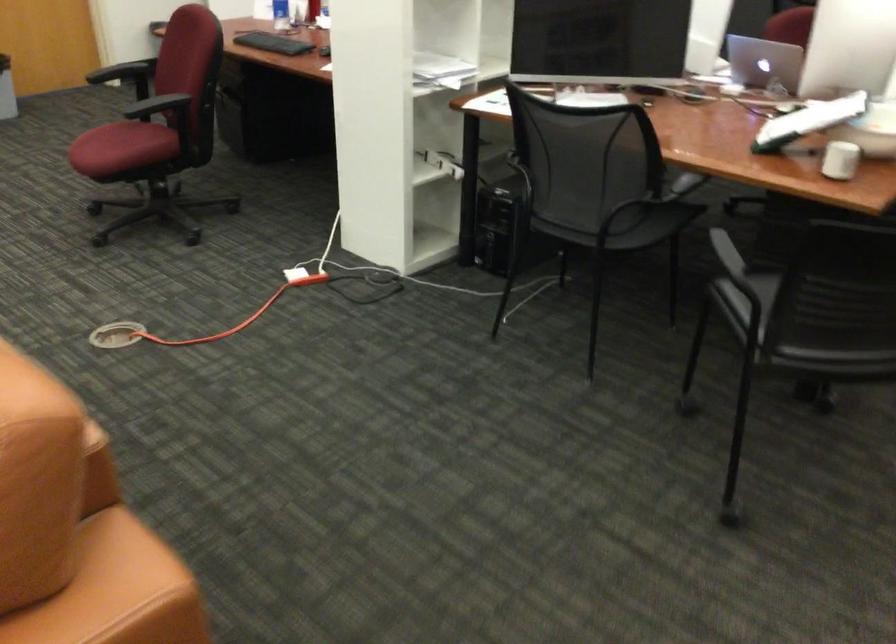
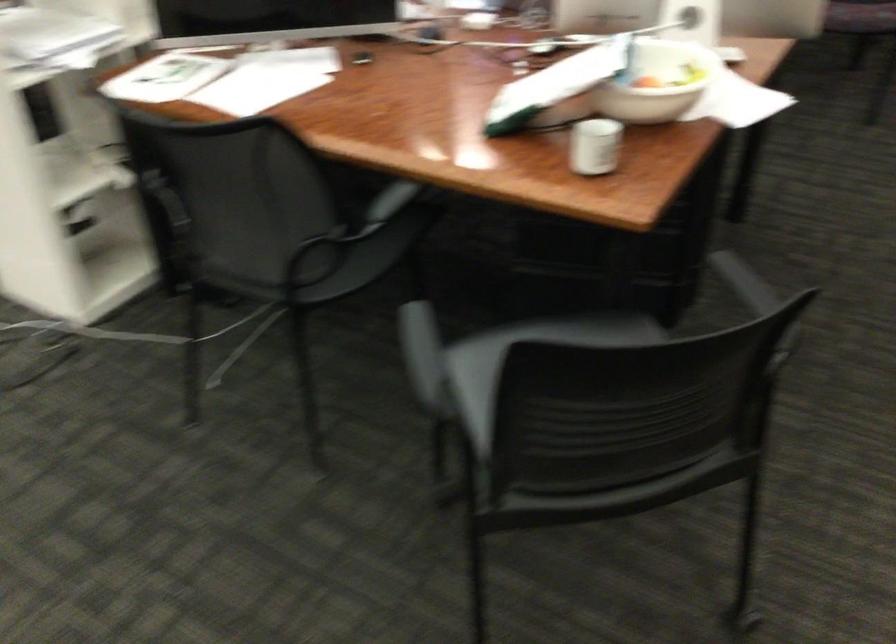
Question: The first image is from the beginning of the video and the second image is from the end. How did the camera likely rotate when shooting the video?

Choices:
 (A) Left
 (B) Right
 (C) Up
 (D) Down

Answer: (B)